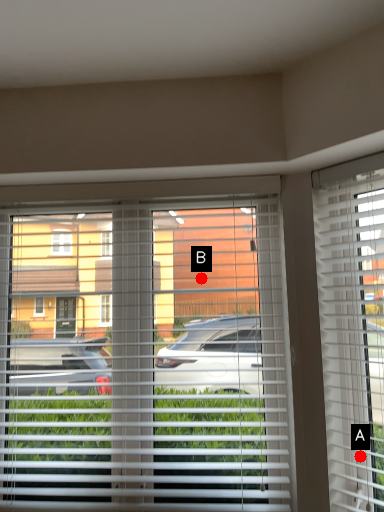
Question: Two points are circled on the image, labeled by A and B beside each circle. Which of the following is the farthest from the observer?

Choices:
 (A) A is further
 (B) B is further

Answer: (B)